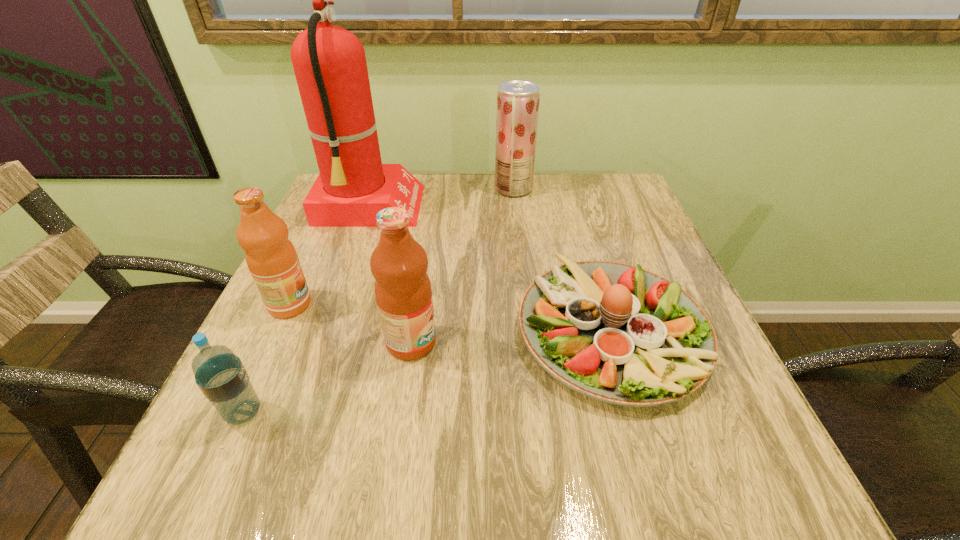
Locate an element on the screen. The image size is (960, 540). the tallest object is located at coordinates (329, 62).

Where is `the farthest fruit juice`? the farthest fruit juice is located at coordinates (518, 101).

Find the location of a particular element. The image size is (960, 540). the second fruit juice from left to right is located at coordinates (403, 293).

Image resolution: width=960 pixels, height=540 pixels. Find the location of `the leftmost fruit juice`. the leftmost fruit juice is located at coordinates (272, 260).

Where is `the second shortest object`? the second shortest object is located at coordinates (221, 376).

Find the location of a particular element. the shortest object is located at coordinates (620, 334).

This screenshot has width=960, height=540. I want to click on free space located 0.390m on the front-facing side of the fire extinguisher, so click(567, 208).

The width and height of the screenshot is (960, 540). Identify the location of blank space located 0.230m on the front of the farthest fruit juice. (520, 250).

This screenshot has width=960, height=540. I want to click on vacant space located on the front label of the nearest fruit juice, so click(496, 342).

In order to click on free region located on the label side of the second nearest fruit juice in this screenshot , I will do `click(386, 305)`.